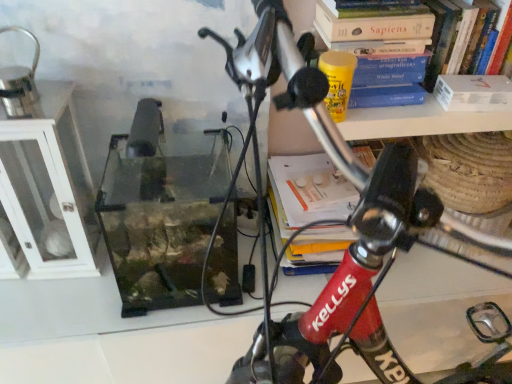
This screenshot has height=384, width=512. What do you see at coordinates (49, 186) in the screenshot? I see `white glass cabinet at left` at bounding box center [49, 186].

Measure the distance between point (46, 230) and camera.

Point (46, 230) is 1.16 meters from camera.

Describe the element at coordinates (474, 93) in the screenshot. The height and width of the screenshot is (384, 512). I see `white matte paperback book at upper right` at that location.

How much space does hardcover book at upper right, positioned as the 2th book in right-to-left order, occupy horizontally?

hardcover book at upper right, positioned as the 2th book in right-to-left order, is 7.91 inches wide.

Locate an element on the screen. The width and height of the screenshot is (512, 384). red matte bicycle handlebar at center is located at coordinates (339, 220).

Image resolution: width=512 pixels, height=384 pixels. In order to click on white glass cabinet at left in this screenshot , I will do `click(49, 186)`.

From a real-world perspective, which is physically below, hardcover book at upper right, positioned as the 2th book in right-to-left order, or hardcover book at upper right, which is the second book in left-to-right order?

In real-world perspective, hardcover book at upper right, positioned as the 2th book in right-to-left order, is lower.

Does point (417, 15) come closer to viewer compared to point (492, 22)?

Yes.

Considering the sizes of objects hardcover book at upper right, positioned as the 2th book in right-to-left order, and hardcover book at upper right, which is the second book in left-to-right order, in the image provided, who is shorter, hardcover book at upper right, positioned as the 2th book in right-to-left order, or hardcover book at upper right, which is the second book in left-to-right order,?

hardcover book at upper right, positioned as the 2th book in right-to-left order.

Considering the sizes of objects hardcover book at upper right, which is the first book from left to right, and hardcover book at upper right, which is the second book in left-to-right order, in the image provided, who is thinner, hardcover book at upper right, which is the first book from left to right, or hardcover book at upper right, which is the second book in left-to-right order,?

With smaller width is hardcover book at upper right, which is the second book in left-to-right order.

Who is taller, hardcover book at upper right, positioned as the first book in right-to-left order, or white matte paperback book at upper right?

hardcover book at upper right, positioned as the first book in right-to-left order.

How far apart are hardcover book at upper right, positioned as the first book in right-to-left order, and white matte paperback book at upper right?

hardcover book at upper right, positioned as the first book in right-to-left order, and white matte paperback book at upper right are 3.46 inches apart from each other.

Is hardcover book at upper right, which is the second book in left-to-right order, inside or outside of white matte paperback book at upper right?

hardcover book at upper right, which is the second book in left-to-right order, lies outside white matte paperback book at upper right.

Between hardcover book at upper right, which is the second book in left-to-right order, and white matte paperback book at upper right, which one has larger width?

hardcover book at upper right, which is the second book in left-to-right order.

Looking at this image, is hardcover book at upper right, which is the second book in left-to-right order, not within red matte bicycle handlebar at center?

Yes, hardcover book at upper right, which is the second book in left-to-right order, is outside of red matte bicycle handlebar at center.

Does hardcover book at upper right, which is the second book in left-to-right order, have a lesser width compared to red matte bicycle handlebar at center?

Yes, hardcover book at upper right, which is the second book in left-to-right order, is thinner than red matte bicycle handlebar at center.

Between hardcover book at upper right, positioned as the first book in right-to-left order, and red matte bicycle handlebar at center, which one has larger size?

red matte bicycle handlebar at center.

How many degrees apart are the facing directions of hardcover book at upper right, positioned as the first book in right-to-left order, and red matte bicycle handlebar at center?

1.52 degrees.

Which is more to the right, white glass cabinet at left or white matte paperback book at upper right?

white matte paperback book at upper right.

Does white glass cabinet at left touch white matte paperback book at upper right?

No, white glass cabinet at left is not making contact with white matte paperback book at upper right.

From a real-world perspective, is white glass cabinet at left positioned above or below white matte paperback book at upper right?

In terms of real-world spatial position, white glass cabinet at left is below white matte paperback book at upper right.

From the image's perspective, which is below, hardcover book at upper right, positioned as the 2th book in right-to-left order, or white glass cabinet at left?

white glass cabinet at left, from the image's perspective.

From their relative heights in the image, would you say hardcover book at upper right, positioned as the 2th book in right-to-left order, is taller or shorter than white glass cabinet at left?

hardcover book at upper right, positioned as the 2th book in right-to-left order, is shorter than white glass cabinet at left.

Considering the positions of point (359, 43) and point (48, 211), is point (359, 43) closer or farther from the camera than point (48, 211)?

Point (359, 43) appears to be closer to the viewer than point (48, 211).

Does hardcover book at upper right, which is the second book in left-to-right order, appear on the right side of white glass cabinet at left?

Correct, you'll find hardcover book at upper right, which is the second book in left-to-right order, to the right of white glass cabinet at left.

Which object is closer to the camera, hardcover book at upper right, which is the second book in left-to-right order, or white glass cabinet at left?

white glass cabinet at left is in front.

Based on the photo, is hardcover book at upper right, positioned as the first book in right-to-left order, placed right next to white glass cabinet at left?

No, hardcover book at upper right, positioned as the first book in right-to-left order, is not in contact with white glass cabinet at left.

Is hardcover book at upper right, positioned as the first book in right-to-left order, wider than white glass cabinet at left?

No.

Which object is further away from the camera taking this photo, hardcover book at upper right, positioned as the 2th book in right-to-left order, or red matte bicycle handlebar at center?

hardcover book at upper right, positioned as the 2th book in right-to-left order.

Is hardcover book at upper right, which is the first book from left to right, beside red matte bicycle handlebar at center?

hardcover book at upper right, which is the first book from left to right, is not next to red matte bicycle handlebar at center, and they're not touching.

Considering the positions of objects hardcover book at upper right, positioned as the 2th book in right-to-left order, and red matte bicycle handlebar at center in the image provided, who is more to the left, hardcover book at upper right, positioned as the 2th book in right-to-left order, or red matte bicycle handlebar at center?

Positioned to the left is hardcover book at upper right, positioned as the 2th book in right-to-left order.

Which is in front, point (466, 15) or point (364, 194)?

The point (364, 194) is closer.

Where is `book that is under the hardcover book at upper right, positioned as the first book in right-to-left order (from a real-world perspective)`? The width and height of the screenshot is (512, 384). book that is under the hardcover book at upper right, positioned as the first book in right-to-left order (from a real-world perspective) is located at coordinates (408, 30).

Which book is the 1st one when counting from the front of the white matte paperback book at upper right? Please provide its 2D coordinates.

[(459, 35)]

Estimate the real-world distances between objects in this image. Which object is further from white glass cabinet at left, hardcover book at upper right, positioned as the 2th book in right-to-left order, or hardcover book at upper right, positioned as the first book in right-to-left order?

hardcover book at upper right, positioned as the first book in right-to-left order, is further to white glass cabinet at left.

Which object lies nearer to the anchor point white glass cabinet at left, hardcover book at upper right, which is the second book in left-to-right order, or hardcover book at upper right, which is the first book from left to right?

hardcover book at upper right, which is the first book from left to right, is closer to white glass cabinet at left.

Looking at the image, which one is located closer to hardcover book at upper right, which is the second book in left-to-right order, hardcover book at upper right, which is the first book from left to right, or white glass cabinet at left?

hardcover book at upper right, which is the first book from left to right, lies closer to hardcover book at upper right, which is the second book in left-to-right order, than the other object.

From the image, which object appears to be farther from hardcover book at upper right, positioned as the 2th book in right-to-left order, white matte paperback book at upper right or hardcover book at upper right, positioned as the first book in right-to-left order?

Based on the image, white matte paperback book at upper right appears to be further to hardcover book at upper right, positioned as the 2th book in right-to-left order.

Estimate the real-world distances between objects in this image. Which object is closer to white matte paperback book at upper right, white glass cabinet at left or hardcover book at upper right, which is the second book in left-to-right order?

hardcover book at upper right, which is the second book in left-to-right order, is closer to white matte paperback book at upper right.

Based on their spatial positions, is hardcover book at upper right, positioned as the 2th book in right-to-left order, or white glass cabinet at left further from red matte bicycle handlebar at center?

Based on the image, white glass cabinet at left appears to be further to red matte bicycle handlebar at center.

Considering their positions, is red matte bicycle handlebar at center positioned closer to white glass cabinet at left than white matte paperback book at upper right?

red matte bicycle handlebar at center lies closer to white glass cabinet at left than the other object.

Which object lies further to the anchor point hardcover book at upper right, positioned as the first book in right-to-left order, hardcover book at upper right, positioned as the 2th book in right-to-left order, or white matte paperback book at upper right?

Among the two, white matte paperback book at upper right is located further to hardcover book at upper right, positioned as the first book in right-to-left order.

The image size is (512, 384). I want to click on book located between white glass cabinet at left and hardcover book at upper right, positioned as the first book in right-to-left order, in the left-right direction, so click(x=408, y=30).

What are the coordinates of `book between white glass cabinet at left and red matte bicycle handlebar at center` in the screenshot? It's located at (408, 30).

Locate an element on the screen. The width and height of the screenshot is (512, 384). book between red matte bicycle handlebar at center and hardcover book at upper right, which is the second book in left-to-right order, from front to back is located at coordinates [408, 30].

The height and width of the screenshot is (384, 512). What are the coordinates of `book between white glass cabinet at left and white matte paperback book at upper right in the horizontal direction` in the screenshot? It's located at (408, 30).